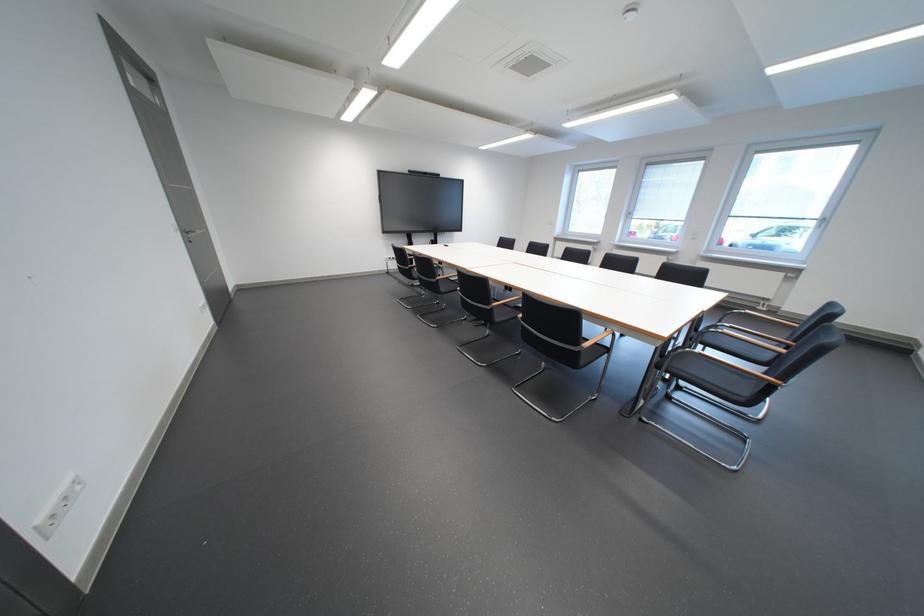
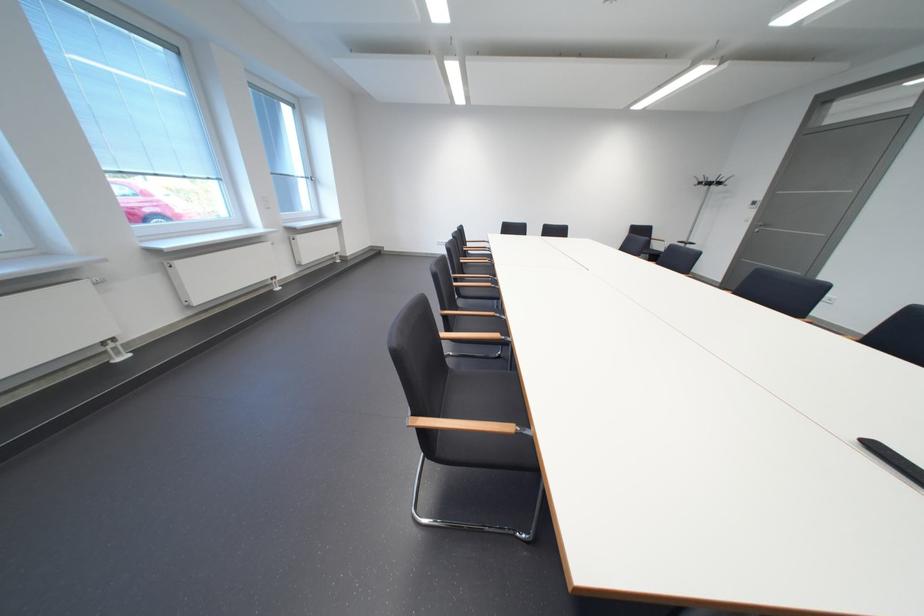
Question: I am providing you with two images of the same scene from different viewpoints. Please identify which objects are invisible in image2.

Choices:
 (A) black chair sitting surface
 (B) pink plastic container
 (C) wooden chair armrest
 (D) silver door handle

Answer: (C)